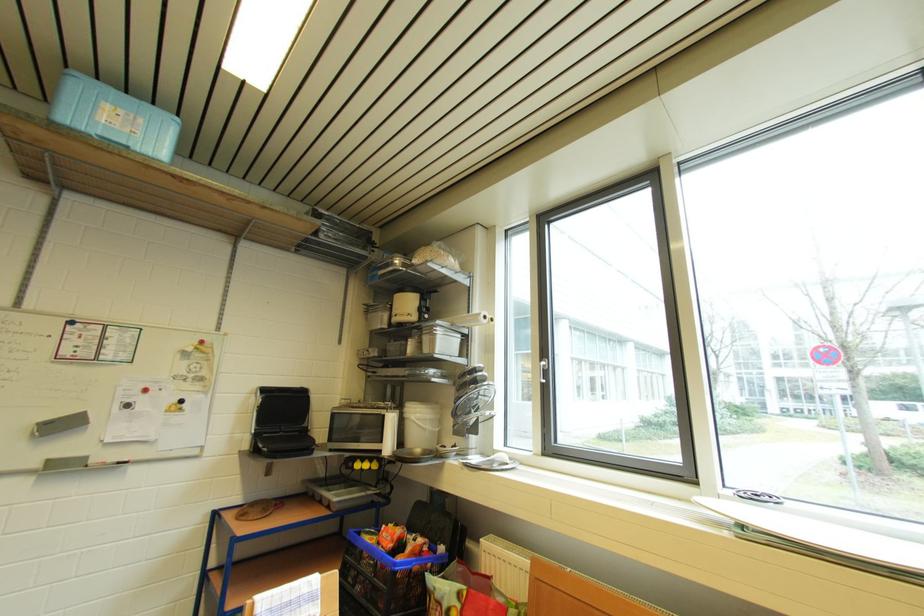
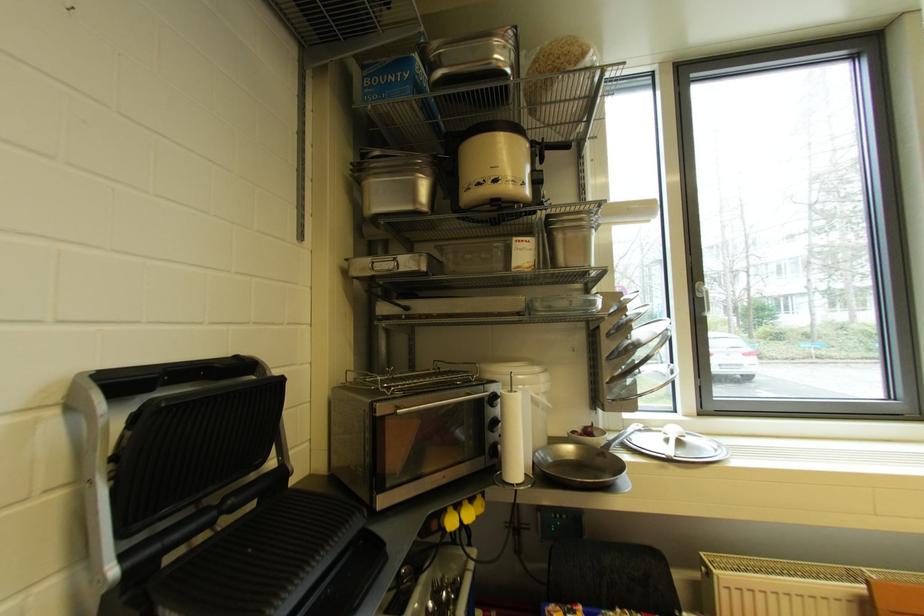
Find the pixel in the second image that matches (x=373, y=464) in the first image.

(472, 505)